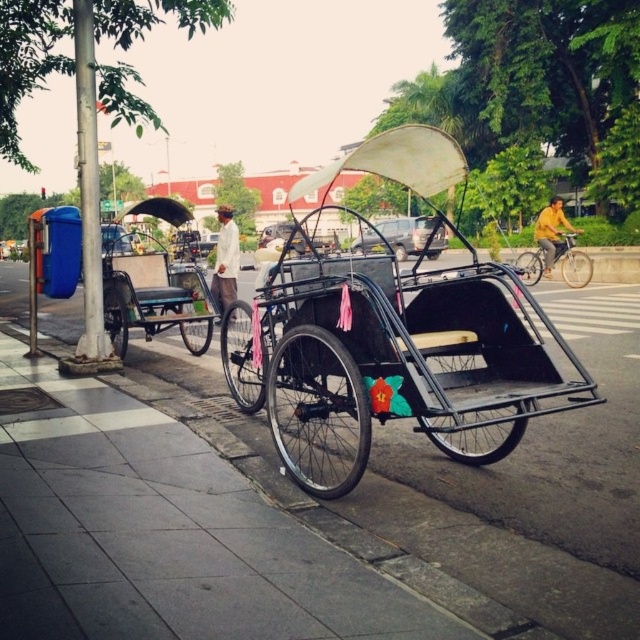
You are a photographer standing on the sidewalk. You want to take a photo of the metallic black rickshaw at center and the white matte shirt at center. Since you want to emphasize the size difference between them, which object should you position closer to the camera to achieve this effect?

To emphasize the size difference between the metallic black rickshaw at center and the white matte shirt at center, you should position the white matte shirt at center closer to the camera. This is because the metallic black rickshaw at center is already larger in size, and bringing the smaller object closer can create a visual contrast where they appear similar in size in the photo, highlighting their actual size difference.

You are a tourist standing on the sidewalk and want to take a photo of the metallic black rickshaw at center and the metallic pavement at center. Which object should you focus on first to ensure it appears larger in your photo?

The metallic black rickshaw at center is closer to you than the metallic pavement at center, so focusing on it first will make it appear larger in the photo.

You are a delivery person needing to carry a large package that requires a space wider than the white matte shirt at center. Can the metallic black rickshaw at center accommodate this package?

The metallic black rickshaw at center is wider than the white matte shirt at center, so it can accommodate the large package requiring more width.